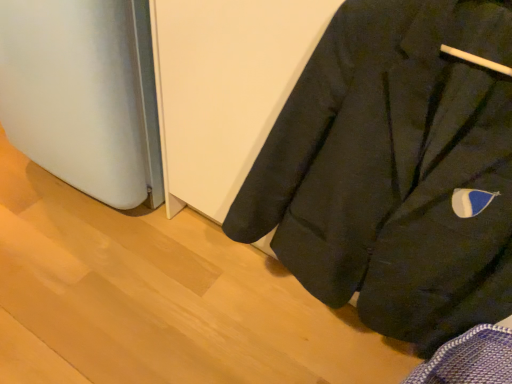
Where is `free region under black matte coat at lower right (from a real-world perspective)`? free region under black matte coat at lower right (from a real-world perspective) is located at coordinates (313, 332).